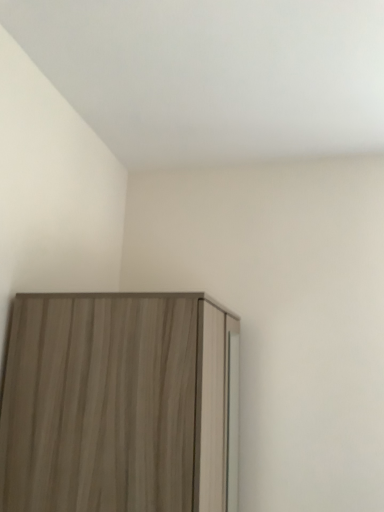
You are a GUI agent. You are given a task and a screenshot of the screen. Output one action in this format:
    pyautogui.click(x=<x>, y=<y>)
    Task: Click on the wooden cupboard at lower left
    The width and height of the screenshot is (384, 512).
    Given the screenshot: What is the action you would take?
    pyautogui.click(x=120, y=404)

The image size is (384, 512). Describe the element at coordinates (120, 404) in the screenshot. I see `wooden cupboard at lower left` at that location.

Locate an element on the screen. This screenshot has height=512, width=384. wooden cupboard at lower left is located at coordinates (120, 404).